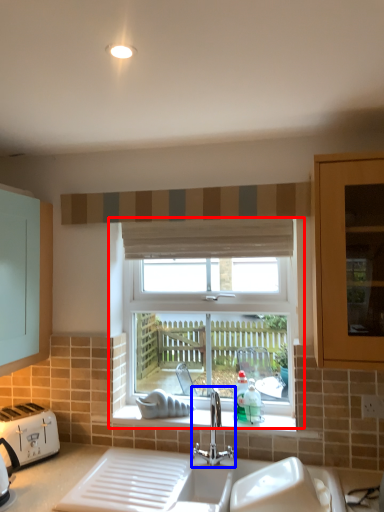
Question: Which object appears closest to the camera in this image, window (highlighted by a red box) or tap (highlighted by a blue box)?

Choices:
 (A) window
 (B) tap

Answer: (B)